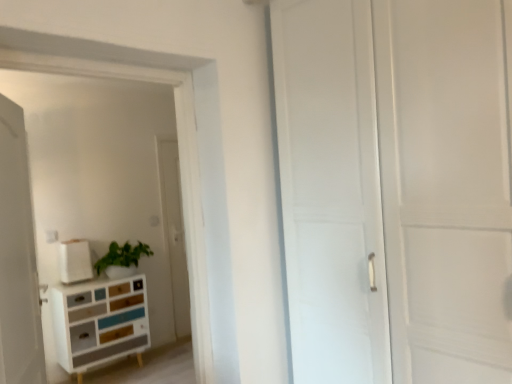
Question: Is multicolored wood chest of drawers at lower left wider or thinner than white matte box at upper left?

Choices:
 (A) wide
 (B) thin

Answer: (A)

Question: Is multicolored wood chest of drawers at lower left spatially inside white matte box at upper left, or outside of it?

Choices:
 (A) inside
 (B) outside

Answer: (B)

Question: Which object is the farthest from the white matte box at upper left?

Choices:
 (A) multicolored wood chest of drawers at lower left
 (B) white matte door at left

Answer: (B)

Question: Considering the real-world distances, which object is farthest from the white matte door at left?

Choices:
 (A) multicolored wood chest of drawers at lower left
 (B) white matte box at upper left

Answer: (B)